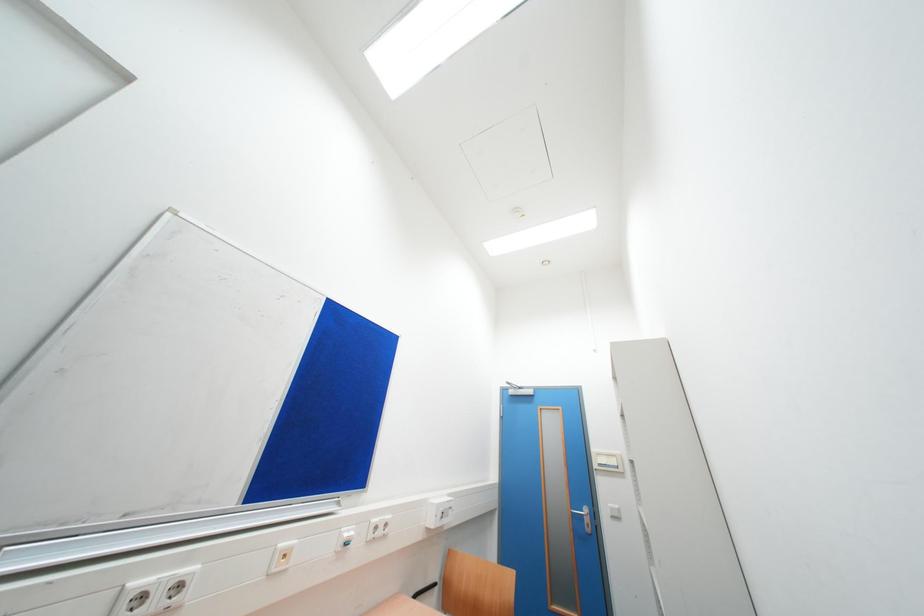
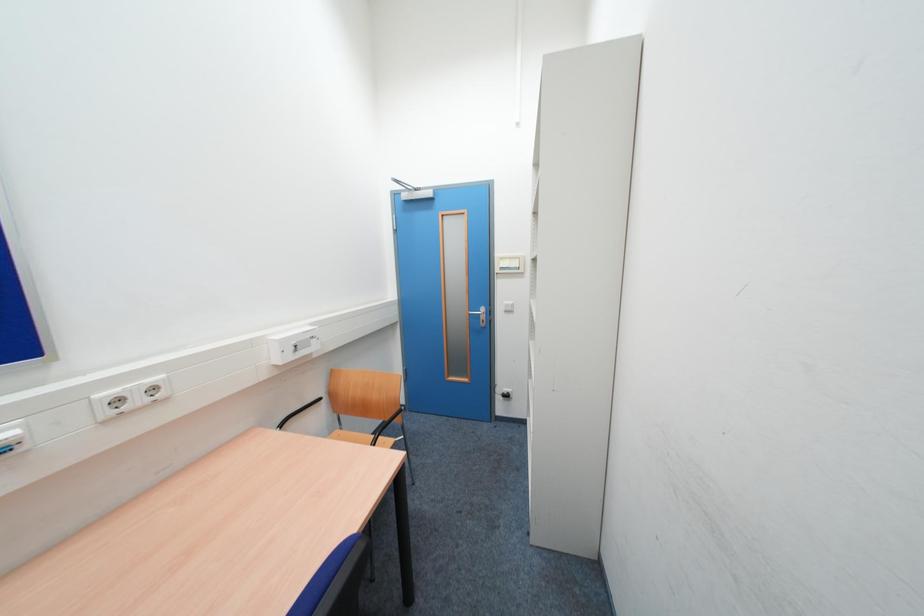
Looking at this image, how did the camera likely rotate?

The rotation direction of the camera is right-down.